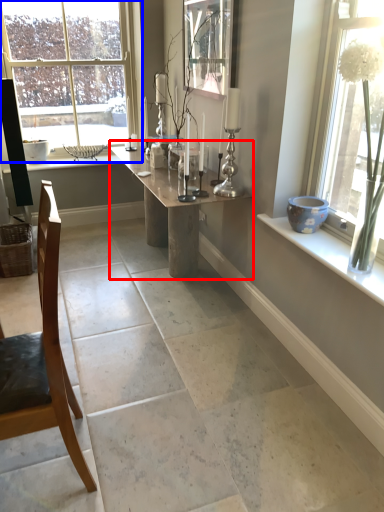
Question: Which point is further to the camera, table (highlighted by a red box) or window (highlighted by a blue box)?

Choices:
 (A) table
 (B) window

Answer: (B)